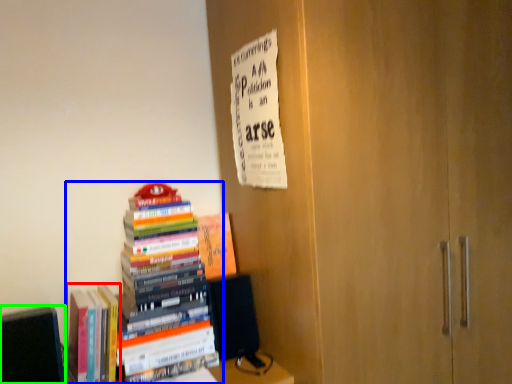
Question: Which object is positioned closest to book (highlighted by a red box)? Select from book (highlighted by a blue box) and book (highlighted by a green box).

Choices:
 (A) book
 (B) book

Answer: (B)